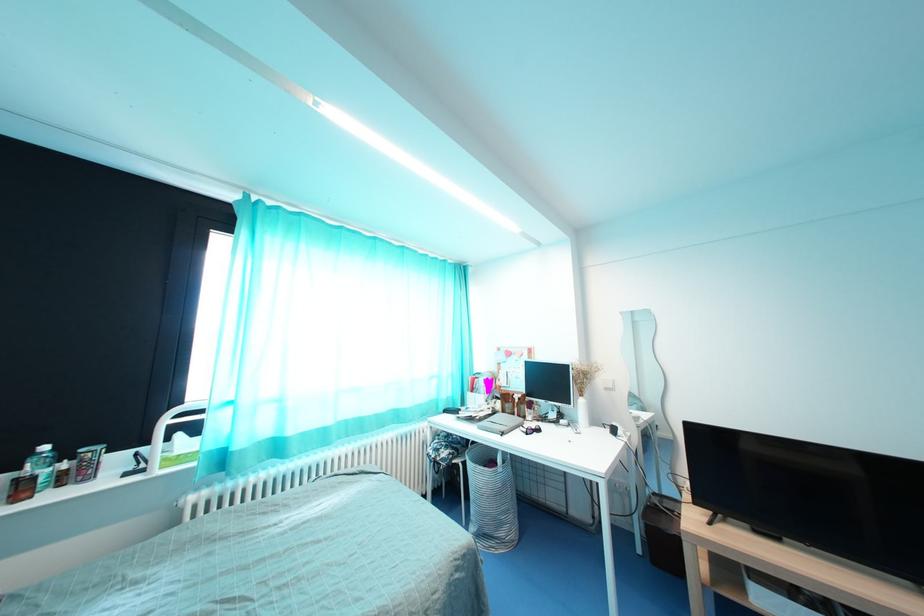
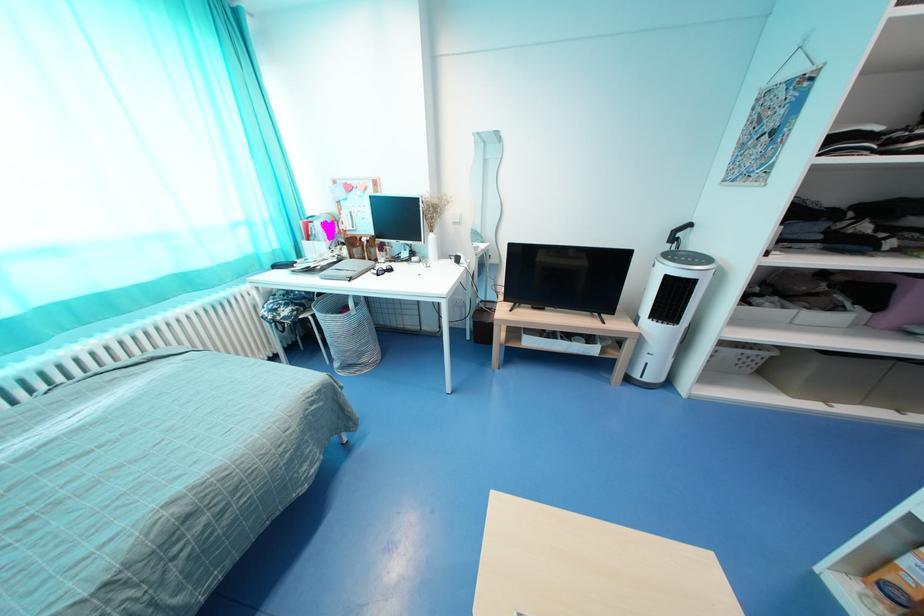
Based on the continuous images, in which direction is the camera rotating?

The camera's rotation is toward right-down.